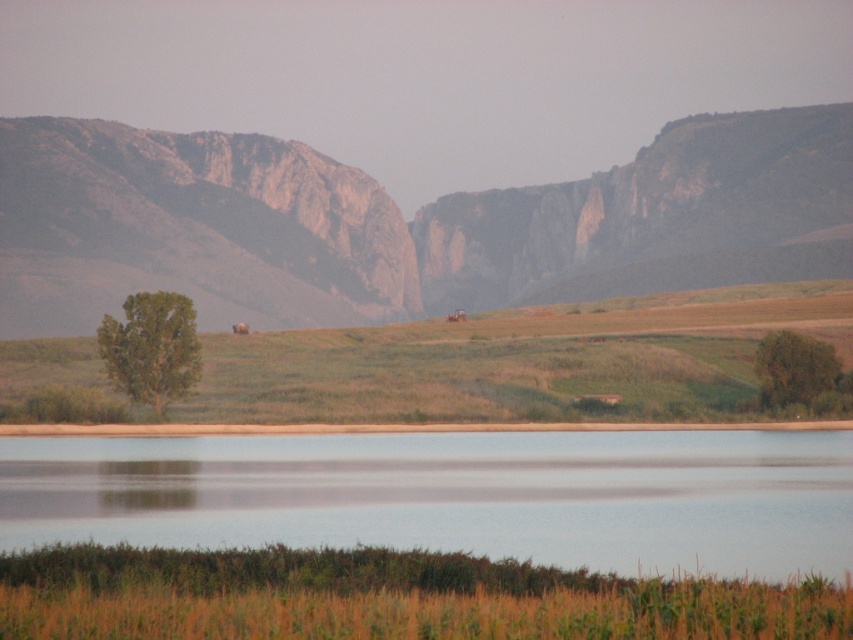
You are a landscape architect designing a walking path between the green leafy tree at center and the green matte tree at right. Which tree will require a wider path to accommodate its spread?

The green leafy tree at center requires a wider path because its width is larger than the green matte tree at right.